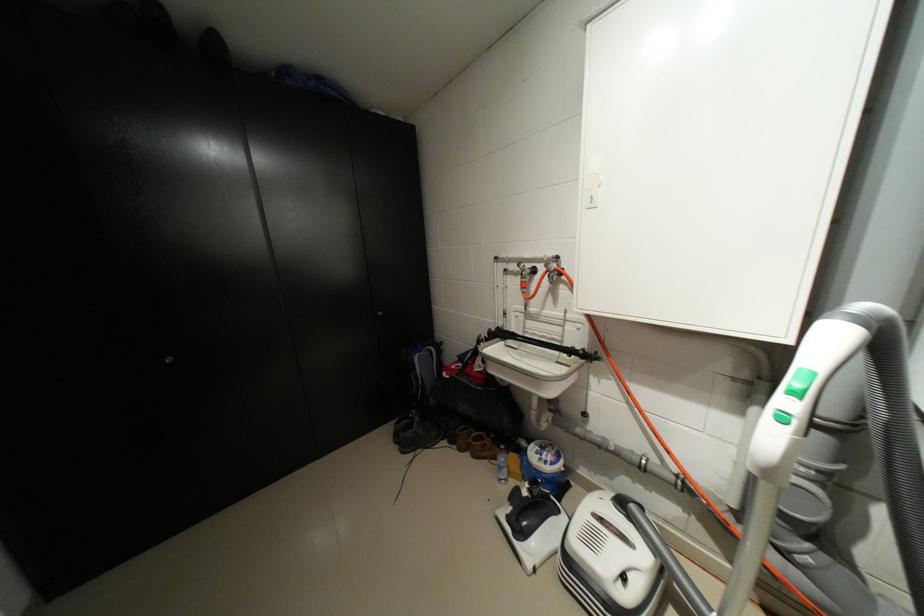
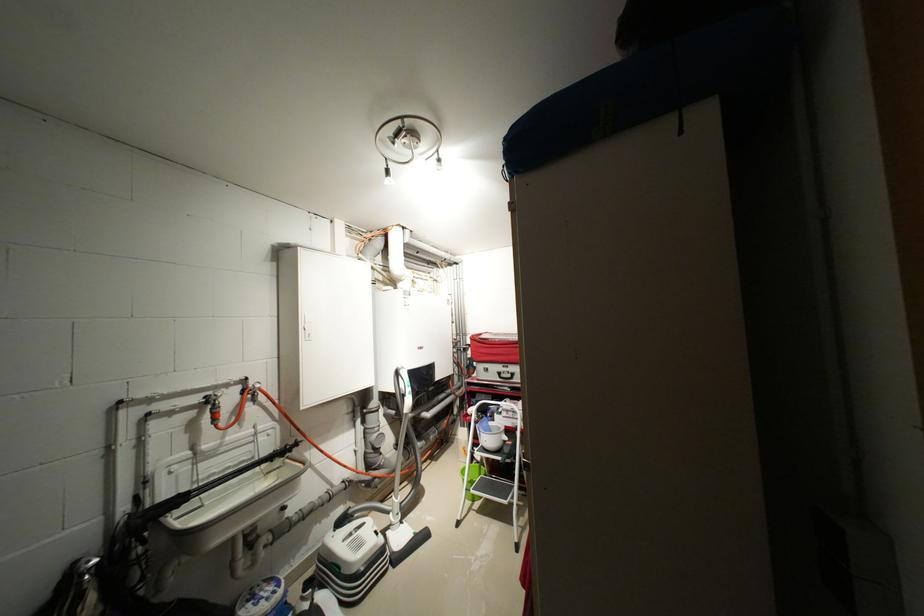
Find the pixel in the second image that matches (x=582, y=331) in the first image.

(273, 439)